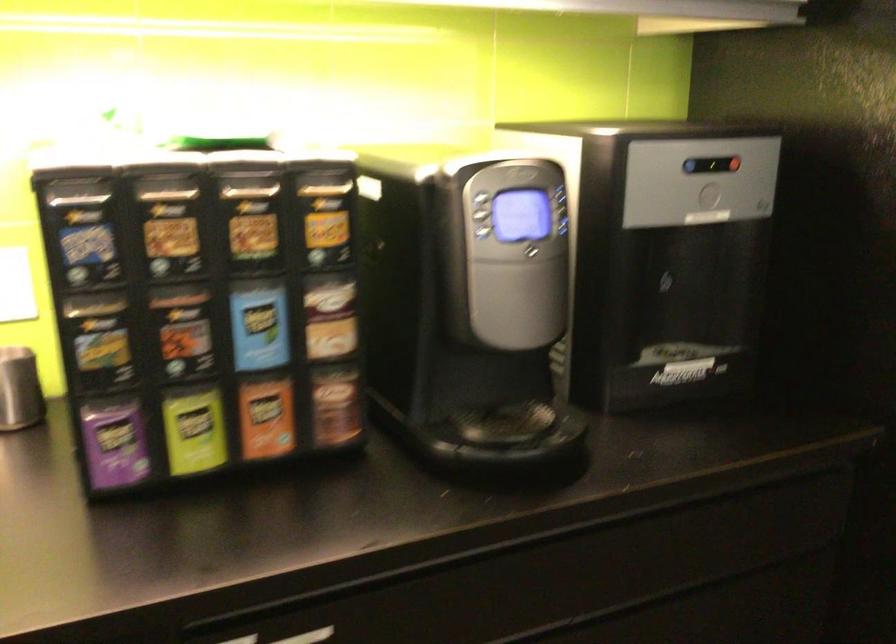
The height and width of the screenshot is (644, 896). Identify the location of red dispenser button. (724, 163).